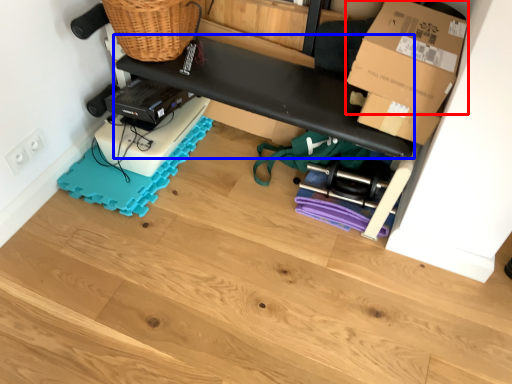
Question: Which of the following is the closest to the observer, box (highlighted by a red box) or shelf (highlighted by a blue box)?

Choices:
 (A) box
 (B) shelf

Answer: (A)